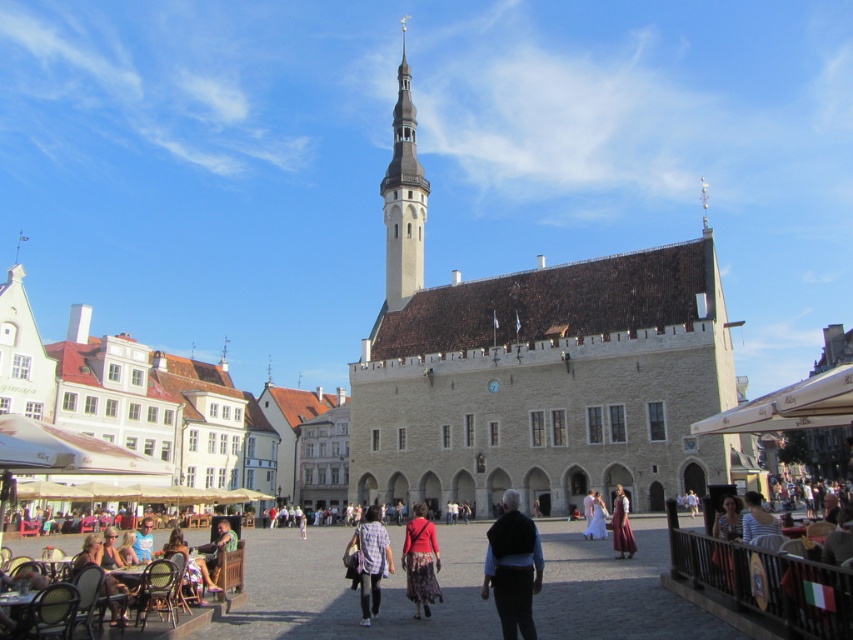
Question: Which point is closer to the camera?

Choices:
 (A) (381, 524)
 (B) (447, 490)
 (C) (619, 547)

Answer: (C)

Question: Which point is farther to the camera?

Choices:
 (A) (421, 177)
 (B) (612, 506)
 (C) (419, 470)

Answer: (A)

Question: Can you confirm if matte black chair at lower left is wider than matte black dress at center?

Choices:
 (A) yes
 (B) no

Answer: (A)

Question: Which point appears closest to the camera in this image?

Choices:
 (A) (415, 508)
 (B) (126, 600)

Answer: (B)

Question: Does matte black dress at center have a smaller size compared to matte brown dress at center?

Choices:
 (A) yes
 (B) no

Answer: (B)

Question: Observing the image, what is the correct spatial positioning of white stone tower at center in reference to white satin dress at center?

Choices:
 (A) below
 (B) above

Answer: (B)